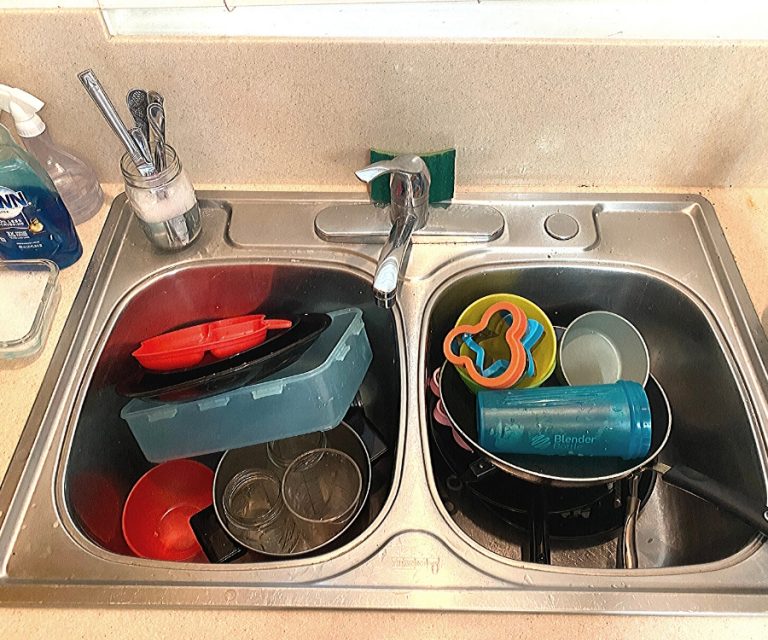
You are a GUI agent. You are given a task and a screenshot of the screen. Output one action in this format:
    pyautogui.click(x=<x>, y=<y>)
    Task: Click on the beige countertop
    
    Given the screenshot: What is the action you would take?
    pyautogui.click(x=358, y=626), pyautogui.click(x=24, y=408), pyautogui.click(x=760, y=240)